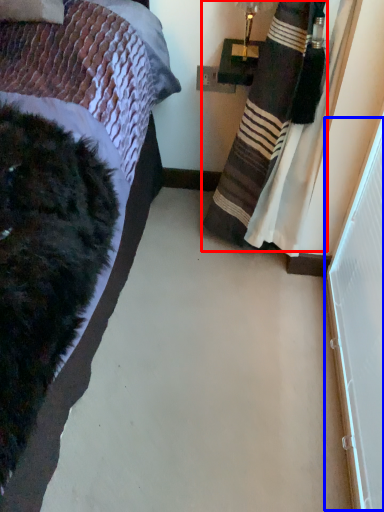
Question: Which point is further to the camera, curtain (highlighted by a red box) or screen door (highlighted by a blue box)?

Choices:
 (A) curtain
 (B) screen door

Answer: (A)